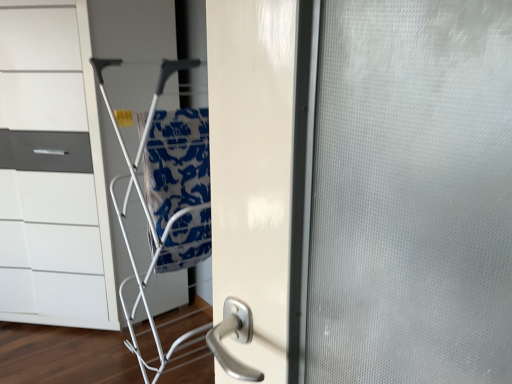
Question: Based on their positions, is silver metallic door handle at center located to the left or right of white glossy chest of drawers at left?

Choices:
 (A) right
 (B) left

Answer: (A)

Question: Based on their sizes in the image, would you say silver metallic door handle at center is bigger or smaller than white glossy chest of drawers at left?

Choices:
 (A) big
 (B) small

Answer: (B)

Question: Considering the real-world distances, which object is closest to the silver metallic door handle at center?

Choices:
 (A) blue printed fabric at center
 (B) white glossy chest of drawers at left

Answer: (A)

Question: Estimate the real-world distances between objects in this image. Which object is closer to the blue printed fabric at center?

Choices:
 (A) white glossy chest of drawers at left
 (B) silver metallic door handle at center

Answer: (A)